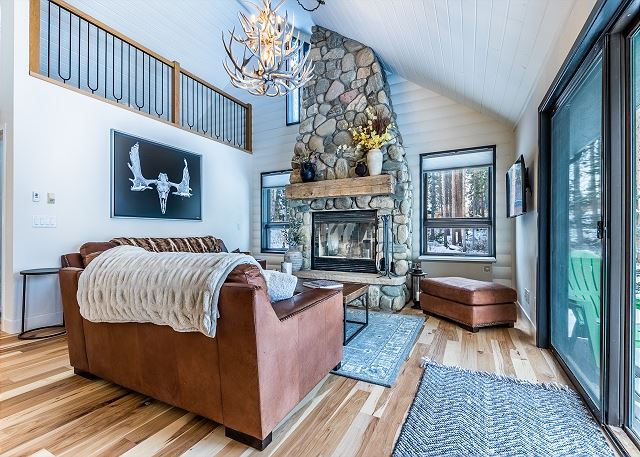
Where is `light hanging from ceiling`? The width and height of the screenshot is (640, 457). light hanging from ceiling is located at coordinates (271, 64).